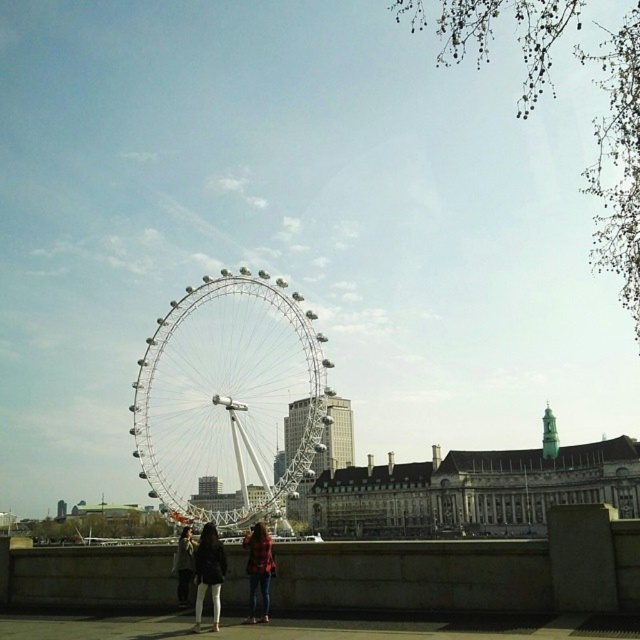
Question: Can you confirm if matte black jacket at lower center is smaller than flannel shirt at center?

Choices:
 (A) no
 (B) yes

Answer: (A)

Question: Can you confirm if metal ferris wheel at center is positioned above dark brown leather jacket at lower center?

Choices:
 (A) yes
 (B) no

Answer: (A)

Question: Which point appears closest to the camera in this image?

Choices:
 (A) (262, 584)
 (B) (189, 563)
 (C) (202, 580)
 (D) (195, 620)

Answer: (D)

Question: Is matte black jacket at lower center closer to the viewer compared to flannel shirt at center?

Choices:
 (A) no
 (B) yes

Answer: (B)

Question: Which point is farther from the camera taking this photo?

Choices:
 (A) (186, 577)
 (B) (216, 596)

Answer: (A)

Question: Estimate the real-world distances between objects in this image. Which object is closer to the flannel shirt at center?

Choices:
 (A) metal ferris wheel at center
 (B) black leather jacket at lower center
 (C) matte black jacket at lower center
 (D) dark brown leather jacket at lower center

Answer: (C)